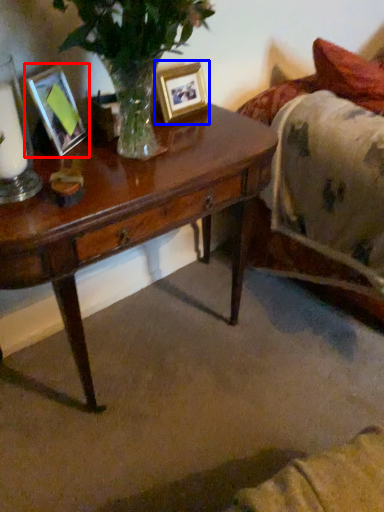
Question: Which object appears closest to the camera in this image, picture frame (highlighted by a red box) or picture frame (highlighted by a blue box)?

Choices:
 (A) picture frame
 (B) picture frame

Answer: (A)